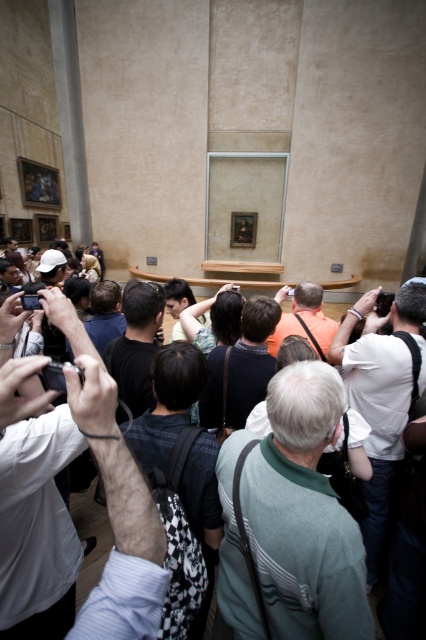
Question: Which of the following is the closest to the observer?

Choices:
 (A) (114, 456)
 (B) (302, 376)
 (C) (34, 371)

Answer: (A)

Question: Estimate the real-world distances between objects in this image. Which object is farther from the green striped sweater at center?

Choices:
 (A) white matte camera at center
 (B) matte black camera at center

Answer: (B)

Question: Can you confirm if green striped sweater at center is bigger than matte black camera at center?

Choices:
 (A) no
 (B) yes

Answer: (B)

Question: Where is white matte camera at center located in relation to matte black camera at center in the image?

Choices:
 (A) left
 (B) right

Answer: (B)

Question: Among these objects, which one is farthest from the camera?

Choices:
 (A) matte black camera at center
 (B) white matte camera at center
 (C) green striped sweater at center

Answer: (C)

Question: Can you confirm if green striped sweater at center is bigger than matte black camera at center?

Choices:
 (A) yes
 (B) no

Answer: (A)